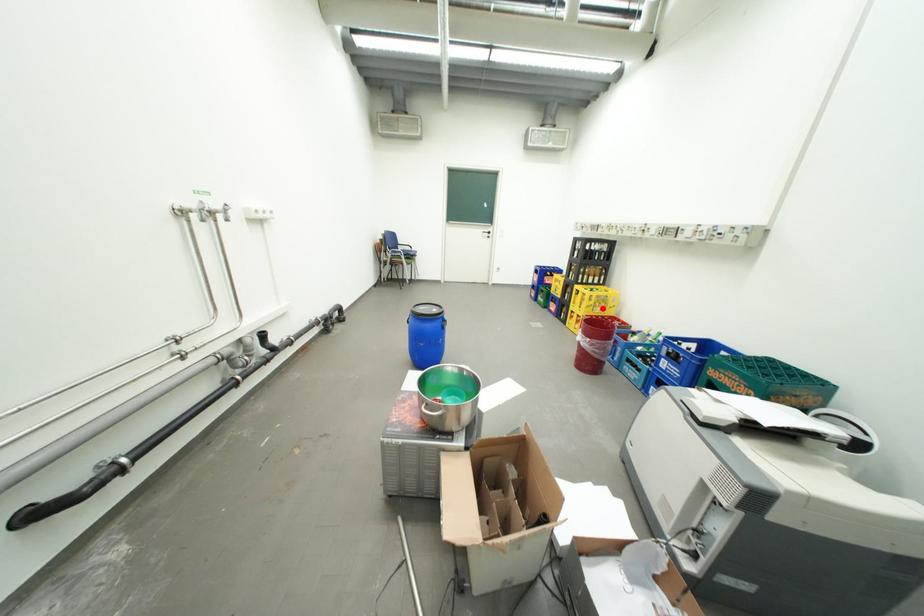
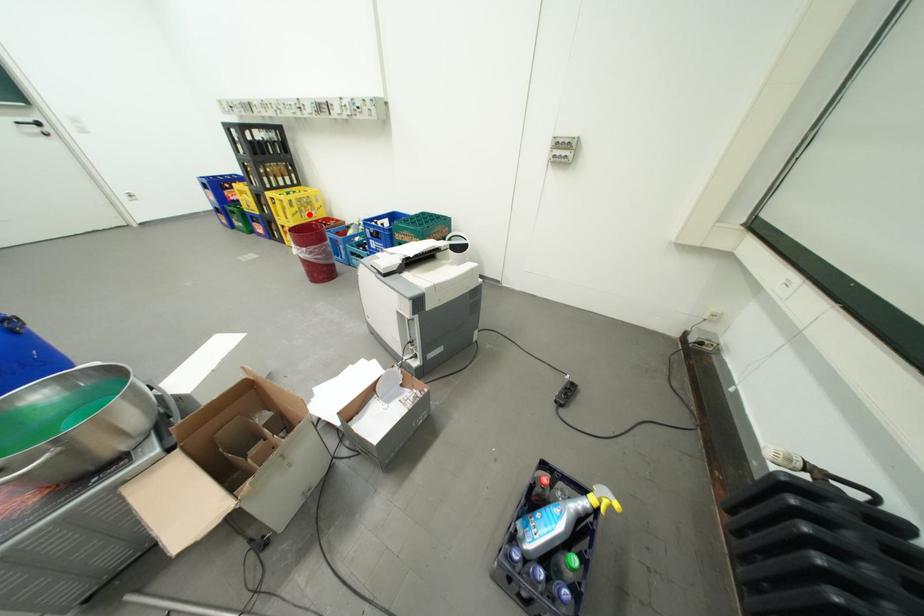
I am providing you with two images of the same scene from different viewpoints. A red point is marked on the first image and another point is marked on the second image. Are the points marked in image1 and image2 representing the same 3D position?

Yes